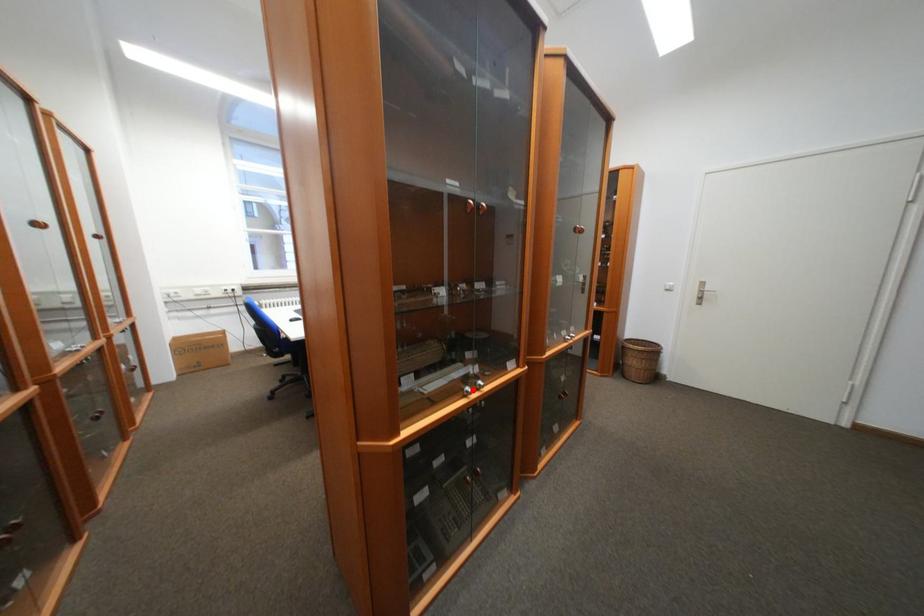
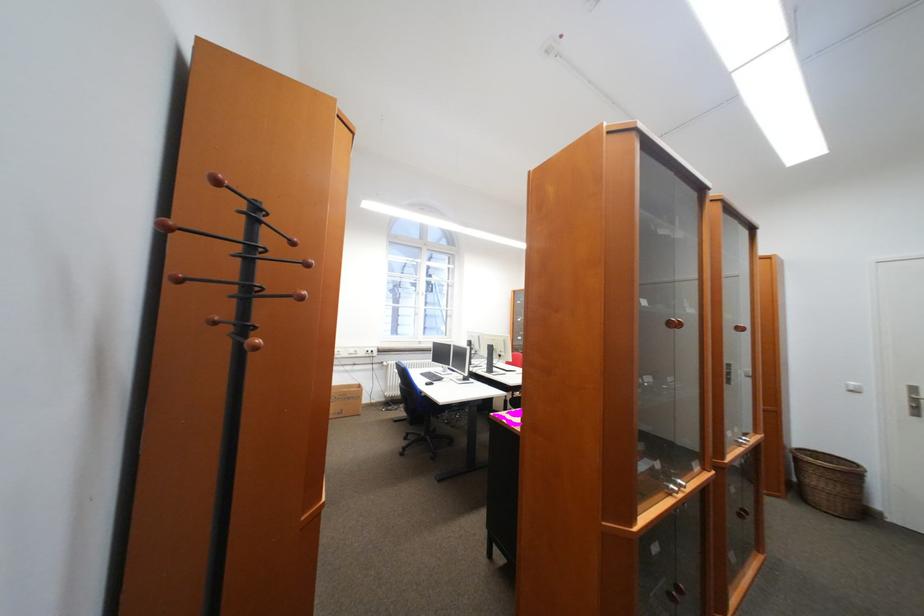
The point at the highlighted location is marked in the first image. Where is the corresponding point in the second image?

(676, 487)